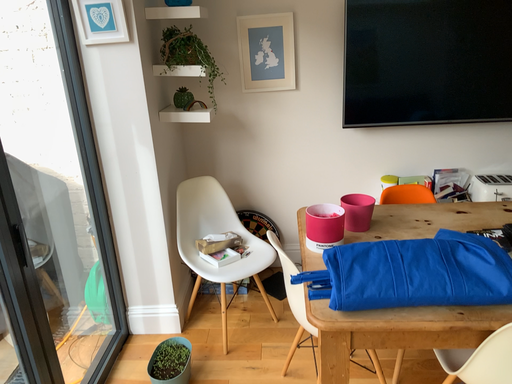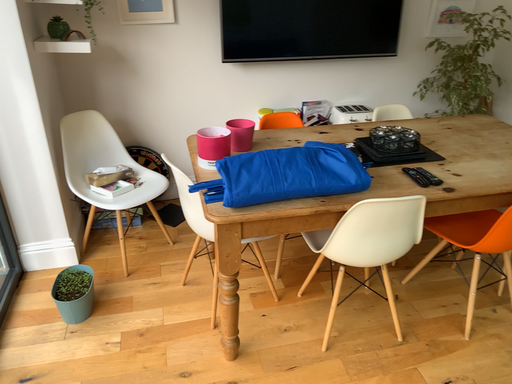
Question: Which way did the camera rotate in the video?

Choices:
 (A) rotated upward
 (B) rotated downward

Answer: (B)